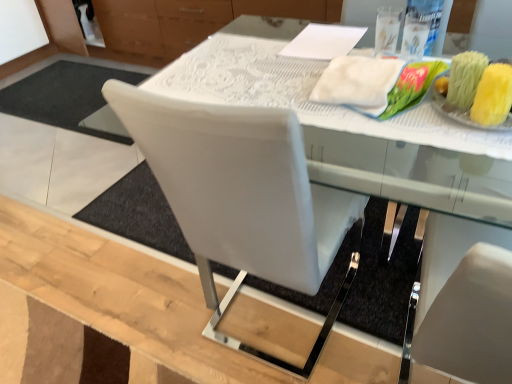
Question: From a real-world perspective, is white leather chair at center above or below white fluffy cloth at upper right?

Choices:
 (A) below
 (B) above

Answer: (A)

Question: Relative to white fluffy cloth at upper right, is white leather chair at center in front or behind?

Choices:
 (A) front
 (B) behind

Answer: (A)

Question: Considering the real-world distances, which object is closest to the white leather chair at center?

Choices:
 (A) white lace tablecloth at center
 (B) white fluffy cloth at upper right

Answer: (A)

Question: Which is farther from the white lace tablecloth at center?

Choices:
 (A) white fluffy cloth at upper right
 (B) white leather chair at center

Answer: (B)